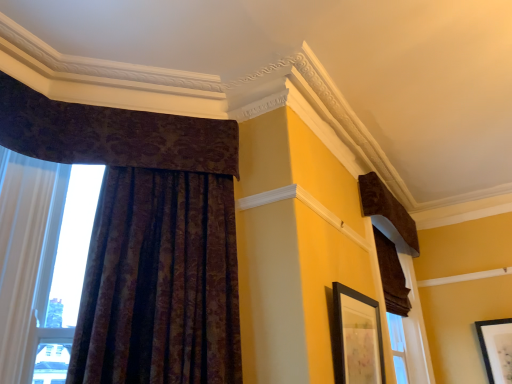
Locate an element on the screen. velvet-like brown curtain at left, which appears as the first curtain when viewed from the left is located at coordinates (146, 237).

The width and height of the screenshot is (512, 384). What are the coordinates of `dark velvet curtain at upper left, which is counted as the third curtain, starting from the right` in the screenshot? It's located at (113, 134).

Locate an element on the screen. The image size is (512, 384). velvet brown curtain at upper right, marked as the first curtain in a right-to-left arrangement is located at coordinates (388, 214).

Where is `black matte picture frame at center, the 2th picture frame in the right-to-left sequence`? black matte picture frame at center, the 2th picture frame in the right-to-left sequence is located at coordinates (357, 338).

Consider the image. Is brown velvet curtain at right, the second curtain in the right-to-left sequence, completely or partially outside of velvet brown curtain at upper right, which is counted as the 4th curtain, starting from the left?

brown velvet curtain at right, the second curtain in the right-to-left sequence, lies outside velvet brown curtain at upper right, which is counted as the 4th curtain, starting from the left,'s area.

In the image, is brown velvet curtain at right, which ranks as the 3th curtain in left-to-right order, positioned in front of or behind velvet brown curtain at upper right, which is counted as the 4th curtain, starting from the left?

In the image, brown velvet curtain at right, which ranks as the 3th curtain in left-to-right order, appears behind velvet brown curtain at upper right, which is counted as the 4th curtain, starting from the left.

Is brown velvet curtain at right, which ranks as the 3th curtain in left-to-right order, aimed at velvet brown curtain at upper right, which is counted as the 4th curtain, starting from the left?

No, brown velvet curtain at right, which ranks as the 3th curtain in left-to-right order, is not facing towards velvet brown curtain at upper right, which is counted as the 4th curtain, starting from the left.

From a real-world perspective, is brown velvet curtain at right, which ranks as the 3th curtain in left-to-right order, physically above velvet brown curtain at upper right, marked as the first curtain in a right-to-left arrangement?

No, from a real-world perspective, brown velvet curtain at right, which ranks as the 3th curtain in left-to-right order, is not on top of velvet brown curtain at upper right, marked as the first curtain in a right-to-left arrangement.

Considering the relative positions of dark velvet curtain at upper left, which is counted as the third curtain, starting from the right, and black matte picture frame at center, the second picture frame positioned from the bottom, in the image provided, is dark velvet curtain at upper left, which is counted as the third curtain, starting from the right, to the left of black matte picture frame at center, the second picture frame positioned from the bottom, from the viewer's perspective?

Correct, you'll find dark velvet curtain at upper left, which is counted as the third curtain, starting from the right, to the left of black matte picture frame at center, the second picture frame positioned from the bottom.

Locate an element on the screen. the 3rd curtain positioned above the black matte picture frame at center, arranged as the first picture frame when viewed from the left (from a real-world perspective) is located at coordinates (113, 134).

Measure the distance from dark velvet curtain at upper left, the second curtain when ordered from left to right, to black matte picture frame at center, the second picture frame when ordered from back to front.

4.20 feet.

From the picture: From the image's perspective, who appears lower, dark velvet curtain at upper left, which is counted as the third curtain, starting from the right, or black matte picture frame at center, the second picture frame positioned from the bottom?

black matte picture frame at center, the second picture frame positioned from the bottom, from the image's perspective.

Looking at this image, is matte black picture frame at upper right, the first picture frame positioned from the back, bigger or smaller than dark velvet curtain at upper left, which is counted as the third curtain, starting from the right?

Clearly, matte black picture frame at upper right, the first picture frame positioned from the back, is smaller in size than dark velvet curtain at upper left, which is counted as the third curtain, starting from the right.

Is matte black picture frame at upper right, which is the second picture frame from left to right, inside the boundaries of dark velvet curtain at upper left, the second curtain when ordered from left to right, or outside?

matte black picture frame at upper right, which is the second picture frame from left to right, exists outside the volume of dark velvet curtain at upper left, the second curtain when ordered from left to right.

Can you confirm if matte black picture frame at upper right, the 2th picture frame viewed from the front, is thinner than dark velvet curtain at upper left, which is counted as the third curtain, starting from the right?

Yes, matte black picture frame at upper right, the 2th picture frame viewed from the front, is thinner than dark velvet curtain at upper left, which is counted as the third curtain, starting from the right.

Who is shorter, matte black picture frame at upper right, which appears as the first picture frame when ordered from the bottom, or dark velvet curtain at upper left, which is counted as the third curtain, starting from the right?

Standing shorter between the two is dark velvet curtain at upper left, which is counted as the third curtain, starting from the right.

Is black matte picture frame at center, the 2th picture frame in the right-to-left sequence, further to camera compared to velvet brown curtain at upper right, which is counted as the 4th curtain, starting from the left?

That is False.

Between black matte picture frame at center, arranged as the 1th picture frame when viewed from the front, and velvet brown curtain at upper right, marked as the first curtain in a right-to-left arrangement, which one appears on the right side from the viewer's perspective?

Positioned to the right is velvet brown curtain at upper right, marked as the first curtain in a right-to-left arrangement.

Is black matte picture frame at center, arranged as the first picture frame when viewed from the left, outside of velvet brown curtain at upper right, which is counted as the 4th curtain, starting from the left?

Yes.

Does black matte picture frame at center, arranged as the first picture frame when viewed from the left, have a greater width compared to velvet brown curtain at upper right, which is counted as the 4th curtain, starting from the left?

No.

Is point (167, 138) positioned behind point (380, 236)?

No, it is in front of (380, 236).

Considering the sizes of objects dark velvet curtain at upper left, which is counted as the third curtain, starting from the right, and brown velvet curtain at right, which ranks as the 3th curtain in left-to-right order, in the image provided, who is taller, dark velvet curtain at upper left, which is counted as the third curtain, starting from the right, or brown velvet curtain at right, which ranks as the 3th curtain in left-to-right order,?

brown velvet curtain at right, which ranks as the 3th curtain in left-to-right order.

From the image's perspective, which object appears higher, dark velvet curtain at upper left, which is counted as the third curtain, starting from the right, or brown velvet curtain at right, which ranks as the 3th curtain in left-to-right order?

dark velvet curtain at upper left, which is counted as the third curtain, starting from the right, appears higher in the image.

Is the depth of dark velvet curtain at upper left, the second curtain when ordered from left to right, greater than that of brown velvet curtain at right, which ranks as the 3th curtain in left-to-right order?

No, the depth of dark velvet curtain at upper left, the second curtain when ordered from left to right, is less than that of brown velvet curtain at right, which ranks as the 3th curtain in left-to-right order.

Which object is more forward, black matte picture frame at center, arranged as the 1th picture frame when viewed from the front, or matte black picture frame at upper right, the 1th picture frame viewed from the right?

black matte picture frame at center, arranged as the 1th picture frame when viewed from the front.

Looking at this image, considering the relative sizes of black matte picture frame at center, the 2th picture frame in the right-to-left sequence, and matte black picture frame at upper right, the 1th picture frame viewed from the right, in the image provided, is black matte picture frame at center, the 2th picture frame in the right-to-left sequence, thinner than matte black picture frame at upper right, the 1th picture frame viewed from the right,?

No.

Could you measure the distance between black matte picture frame at center, the second picture frame positioned from the bottom, and matte black picture frame at upper right, the 2th picture frame viewed from the front?

The distance of black matte picture frame at center, the second picture frame positioned from the bottom, from matte black picture frame at upper right, the 2th picture frame viewed from the front, is 1.99 meters.

Between black matte picture frame at center, the 2th picture frame in the right-to-left sequence, and matte black picture frame at upper right, the 2th picture frame positioned from the top, which one has more height?

Standing taller between the two is matte black picture frame at upper right, the 2th picture frame positioned from the top.

Could you measure the distance between matte black picture frame at upper right, the 1th picture frame viewed from the right, and velvet brown curtain at upper right, which is counted as the 4th curtain, starting from the left?

matte black picture frame at upper right, the 1th picture frame viewed from the right, is 1.22 meters away from velvet brown curtain at upper right, which is counted as the 4th curtain, starting from the left.

From the image's perspective, is matte black picture frame at upper right, the 1th picture frame viewed from the right, on velvet brown curtain at upper right, marked as the first curtain in a right-to-left arrangement?

Actually, matte black picture frame at upper right, the 1th picture frame viewed from the right, appears below velvet brown curtain at upper right, marked as the first curtain in a right-to-left arrangement, in the image.

Considering the relative sizes of matte black picture frame at upper right, the 1th picture frame viewed from the right, and velvet brown curtain at upper right, which is counted as the 4th curtain, starting from the left, in the image provided, is matte black picture frame at upper right, the 1th picture frame viewed from the right, bigger than velvet brown curtain at upper right, which is counted as the 4th curtain, starting from the left,?

Actually, matte black picture frame at upper right, the 1th picture frame viewed from the right, might be smaller than velvet brown curtain at upper right, which is counted as the 4th curtain, starting from the left.

What are the coordinates of `curtain that is on the right side of brown velvet curtain at right, the second curtain in the right-to-left sequence` in the screenshot? It's located at (388, 214).

Locate an element on the screen. the 4th curtain above the black matte picture frame at center, the 2th picture frame in the right-to-left sequence (from the image's perspective) is located at coordinates (113, 134).

Which object lies further to the anchor point black matte picture frame at center, the second picture frame when ordered from back to front, dark velvet curtain at upper left, which is counted as the third curtain, starting from the right, or brown velvet curtain at right, the second curtain in the right-to-left sequence?

dark velvet curtain at upper left, which is counted as the third curtain, starting from the right, is positioned further to the anchor black matte picture frame at center, the second picture frame when ordered from back to front.

Based on their spatial positions, is black matte picture frame at center, which ranks as the first picture frame in top-to-bottom order, or velvet-like brown curtain at left, which appears as the first curtain when viewed from the left, further from velvet brown curtain at upper right, marked as the first curtain in a right-to-left arrangement?

Among the two, velvet-like brown curtain at left, which appears as the first curtain when viewed from the left, is located further to velvet brown curtain at upper right, marked as the first curtain in a right-to-left arrangement.

Which object lies nearer to the anchor point matte black picture frame at upper right, the 1th picture frame viewed from the right, velvet brown curtain at upper right, marked as the first curtain in a right-to-left arrangement, or velvet-like brown curtain at left, the 4th curtain when ordered from right to left?

Based on the image, velvet brown curtain at upper right, marked as the first curtain in a right-to-left arrangement, appears to be nearer to matte black picture frame at upper right, the 1th picture frame viewed from the right.

From the picture: Looking at the image, which one is located further to dark velvet curtain at upper left, which is counted as the third curtain, starting from the right, velvet-like brown curtain at left, the 4th curtain when ordered from right to left, or velvet brown curtain at upper right, marked as the first curtain in a right-to-left arrangement?

velvet brown curtain at upper right, marked as the first curtain in a right-to-left arrangement, is positioned further to the anchor dark velvet curtain at upper left, which is counted as the third curtain, starting from the right.

Estimate the real-world distances between objects in this image. Which object is closer to velvet brown curtain at upper right, which is counted as the 4th curtain, starting from the left, matte black picture frame at upper right, which is the second picture frame from left to right, or velvet-like brown curtain at left, the 4th curtain when ordered from right to left?

The object closer to velvet brown curtain at upper right, which is counted as the 4th curtain, starting from the left, is matte black picture frame at upper right, which is the second picture frame from left to right.

Based on their spatial positions, is dark velvet curtain at upper left, which is counted as the third curtain, starting from the right, or black matte picture frame at center, the second picture frame when ordered from back to front, closer to brown velvet curtain at right, which ranks as the 3th curtain in left-to-right order?

Based on the image, black matte picture frame at center, the second picture frame when ordered from back to front, appears to be nearer to brown velvet curtain at right, which ranks as the 3th curtain in left-to-right order.

Looking at the image, which one is located closer to brown velvet curtain at right, the second curtain in the right-to-left sequence, matte black picture frame at upper right, which is the second picture frame from left to right, or black matte picture frame at center, the 2th picture frame in the right-to-left sequence?

matte black picture frame at upper right, which is the second picture frame from left to right, lies closer to brown velvet curtain at right, the second curtain in the right-to-left sequence, than the other object.

Considering their positions, is brown velvet curtain at right, which ranks as the 3th curtain in left-to-right order, positioned further to dark velvet curtain at upper left, which is counted as the third curtain, starting from the right, than black matte picture frame at center, the second picture frame positioned from the bottom?

brown velvet curtain at right, which ranks as the 3th curtain in left-to-right order, is positioned further to the anchor dark velvet curtain at upper left, which is counted as the third curtain, starting from the right.

Image resolution: width=512 pixels, height=384 pixels. I want to click on picture frame between dark velvet curtain at upper left, which is counted as the third curtain, starting from the right, and velvet brown curtain at upper right, marked as the first curtain in a right-to-left arrangement, so [357, 338].

The height and width of the screenshot is (384, 512). Identify the location of curtain situated between velvet-like brown curtain at left, which appears as the first curtain when viewed from the left, and brown velvet curtain at right, which ranks as the 3th curtain in left-to-right order, from left to right. (113, 134).

Locate an element on the screen. The height and width of the screenshot is (384, 512). picture frame between velvet-like brown curtain at left, the 4th curtain when ordered from right to left, and brown velvet curtain at right, which ranks as the 3th curtain in left-to-right order, from left to right is located at coordinates (357, 338).

Where is `picture frame between dark velvet curtain at upper left, the second curtain when ordered from left to right, and brown velvet curtain at right, which ranks as the 3th curtain in left-to-right order, in the horizontal direction`? Image resolution: width=512 pixels, height=384 pixels. picture frame between dark velvet curtain at upper left, the second curtain when ordered from left to right, and brown velvet curtain at right, which ranks as the 3th curtain in left-to-right order, in the horizontal direction is located at coordinates (357, 338).